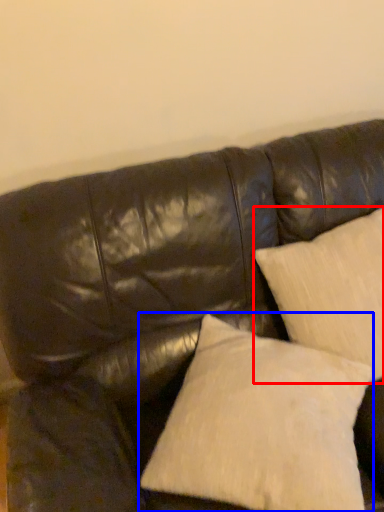
Question: Which object is closer to the camera taking this photo, pillow (highlighted by a red box) or pillow (highlighted by a blue box)?

Choices:
 (A) pillow
 (B) pillow

Answer: (B)